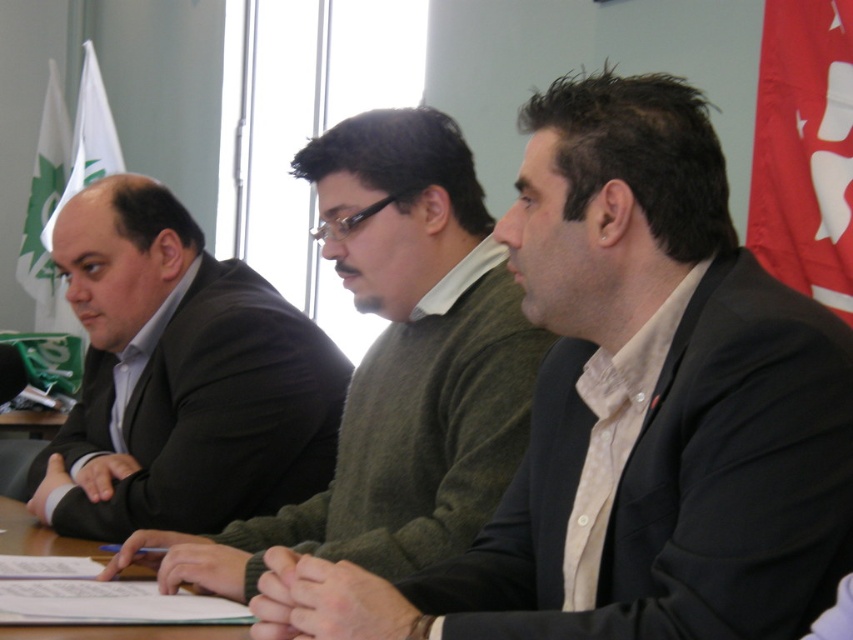
You are an event planner arranging seating for a presentation. You need to ensure that the dark brown suit at left and the wooden table at center are positioned so that the table is visible to all attendees. Given their heights, which object should be placed closer to the front of the room to ensure visibility?

The wooden table at center should be placed closer to the front of the room since it is shorter than the dark brown suit at left, allowing attendees to see over it more easily.